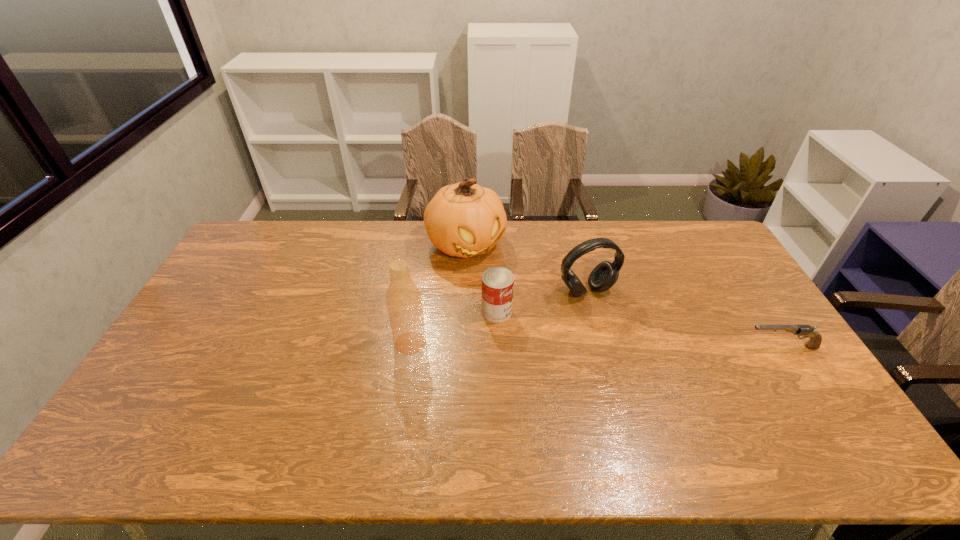
Where is `object that is the closest to the second shortest object`? The height and width of the screenshot is (540, 960). object that is the closest to the second shortest object is located at coordinates (464, 219).

Identify the location of free region that satisfies the following two spatial constraints: 1. on the front side of the rightmost object; 2. aiming along the barrel of the fourth object from left to right. This screenshot has width=960, height=540. (601, 347).

The width and height of the screenshot is (960, 540). What are the coordinates of `free space that satisfies the following two spatial constraints: 1. on the back side of the beer bottle; 2. on the right side of the can` in the screenshot? It's located at click(x=415, y=312).

Locate an element on the screen. free location that satisfies the following two spatial constraints: 1. on the front side of the farthest object; 2. aiming along the barrel of the gun is located at coordinates (462, 347).